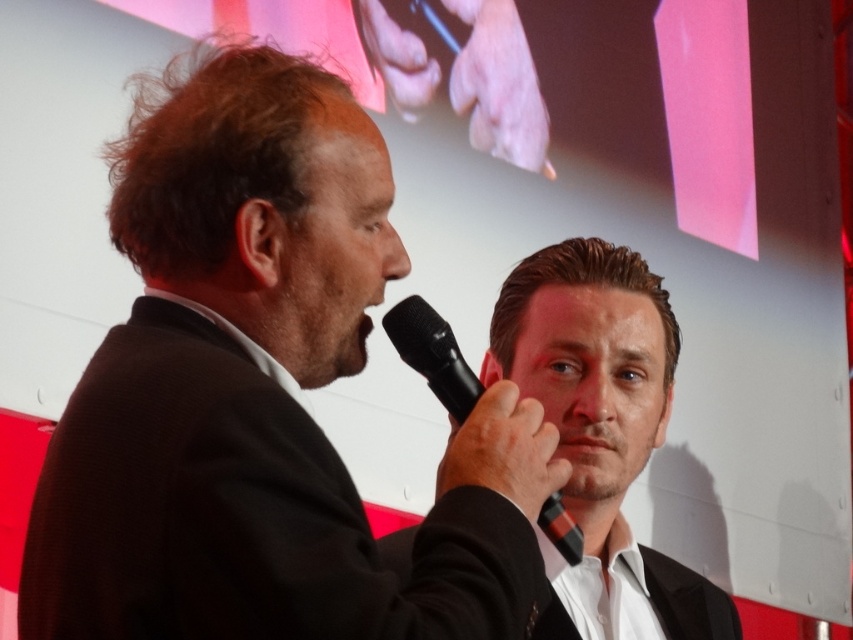
Is black matte suit at left behind black plastic microphone at center?

No, black matte suit at left is closer to the viewer.

Looking at this image, is black matte suit at left thinner than black plastic microphone at center?

No.

Identify the location of black matte suit at left. [x=262, y=396].

Does smooth black suit at center appear on the right side of black plastic microphone at center?

Indeed, smooth black suit at center is positioned on the right side of black plastic microphone at center.

Between point (593, 320) and point (430, 321), which one is positioned behind?

The point (593, 320) is behind.

Is point (578, 605) closer to viewer compared to point (434, 349)?

That is False.

Where is `smooth black suit at center`? This screenshot has width=853, height=640. smooth black suit at center is located at coordinates (602, 433).

Does black matte suit at left have a smaller size compared to smooth black suit at center?

Incorrect, black matte suit at left is not smaller in size than smooth black suit at center.

Between black matte suit at left and smooth black suit at center, which one is positioned lower?

smooth black suit at center is lower down.

Which is behind, point (117, 438) or point (674, 595)?

Positioned behind is point (674, 595).

Find the location of a particular element. black matte suit at left is located at coordinates (262, 396).